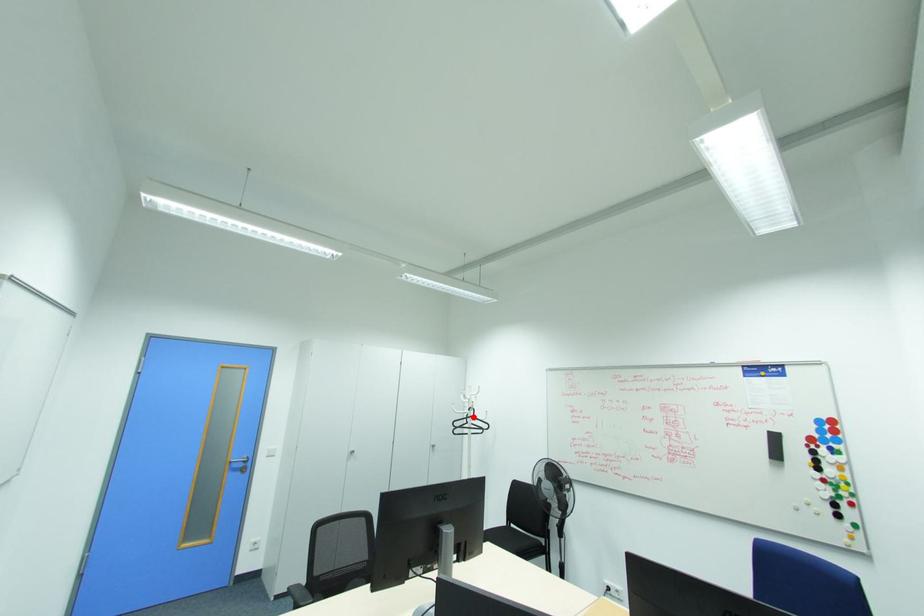
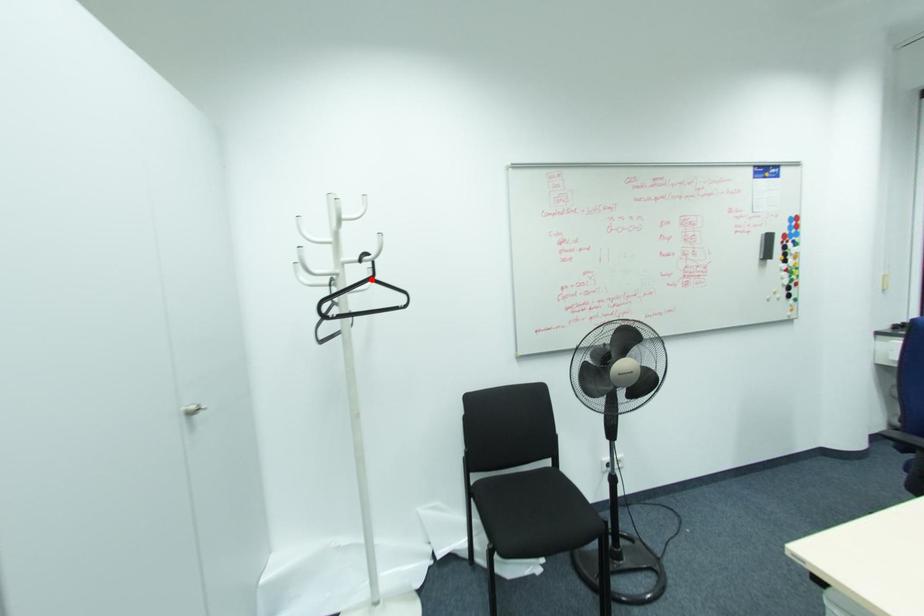
I am providing you with two images of the same scene from different viewpoints. A red point is marked on the first image and another point is marked on the second image. Does the point marked in image1 correspond to the same location as the one in image2?

Yes